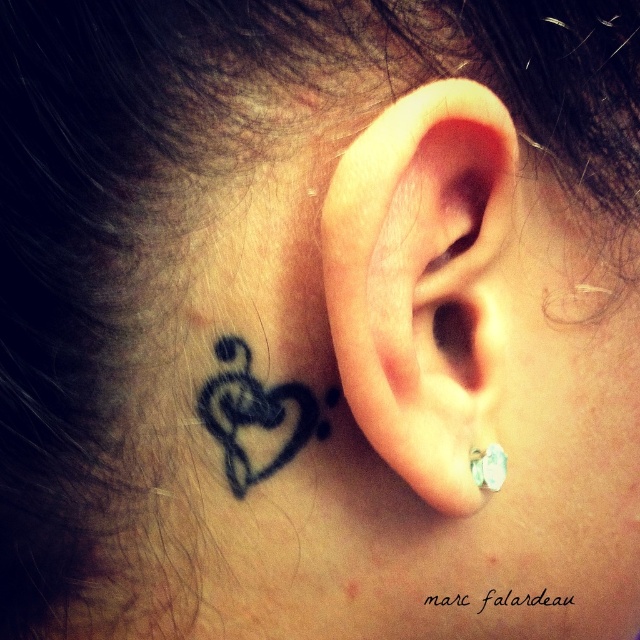
Can you confirm if black ink heart at upper left is thinner than silver metallic earring at ear?

No.

Between point (220, 401) and point (474, 460), which one is positioned behind?

Point (474, 460)

The width and height of the screenshot is (640, 640). What are the coordinates of `black ink heart at upper left` in the screenshot? It's located at (257, 416).

This screenshot has height=640, width=640. Identify the location of black ink heart at upper left. (257, 416).

Does clear skin ear at center lie in front of silver metallic earring at ear?

Yes.

Does clear skin ear at center lie behind silver metallic earring at ear?

That is False.

Image resolution: width=640 pixels, height=640 pixels. Describe the element at coordinates (417, 273) in the screenshot. I see `clear skin ear at center` at that location.

Locate an element on the screen. clear skin ear at center is located at coordinates (417, 273).

Locate an element on the screen. clear skin ear at center is located at coordinates (417, 273).

The height and width of the screenshot is (640, 640). Identify the location of clear skin ear at center. (417, 273).